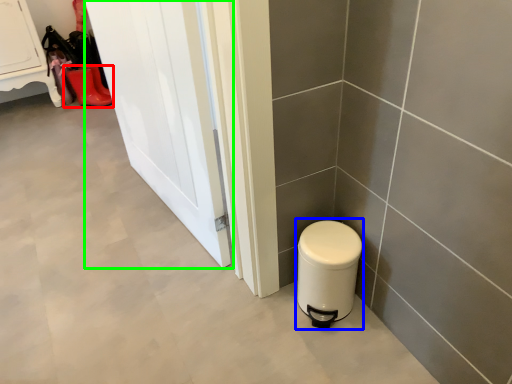
Question: Considering the real-world distances, which object is farthest from footwear (highlighted by a red box)? water heater (highlighted by a blue box) or door (highlighted by a green box)?

Choices:
 (A) water heater
 (B) door

Answer: (A)